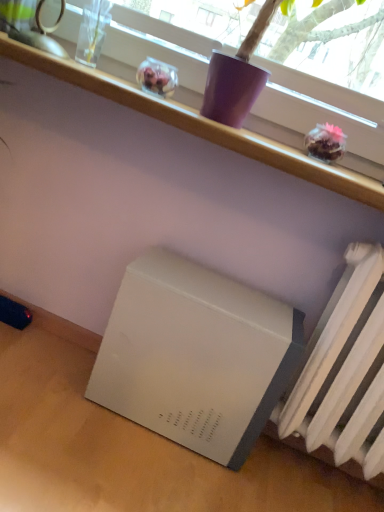
Locate an element on the screen. free space in front of white matte refrigerator at lower left is located at coordinates coord(127,470).